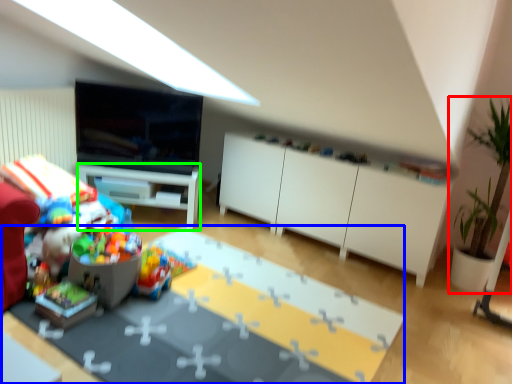
Question: Which object is the farthest from houseplant (highlighted by a red box)? Choose among these: table (highlighted by a blue box) or desk (highlighted by a green box).

Choices:
 (A) table
 (B) desk

Answer: (B)